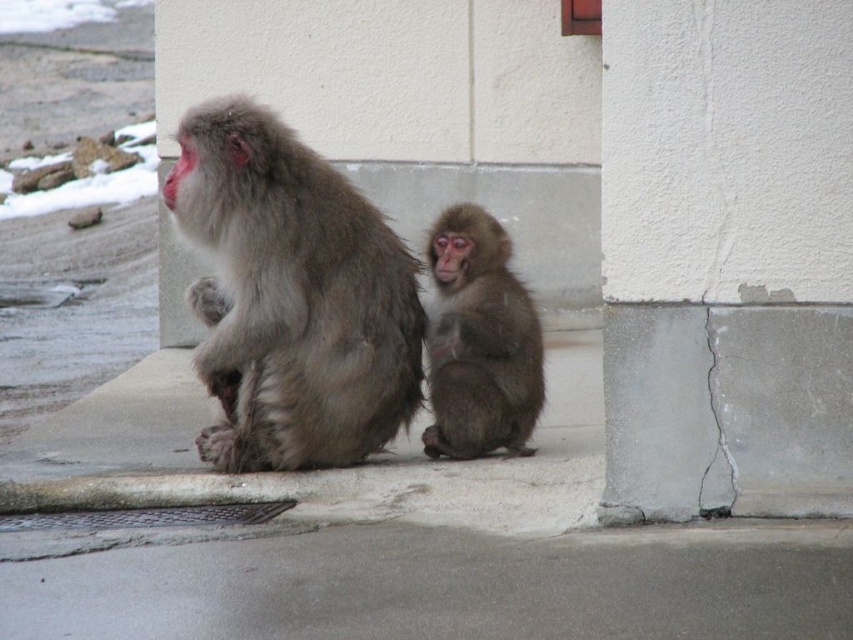
Question: Which object is farther from the camera taking this photo?

Choices:
 (A) fuzzy gray fur monkey at center
 (B) fuzzy brown monkey at center

Answer: (B)

Question: Can you confirm if white concrete pillar at lower right is thinner than fuzzy gray fur monkey at center?

Choices:
 (A) yes
 (B) no

Answer: (A)

Question: Can you confirm if white concrete pillar at lower right is smaller than fuzzy gray fur monkey at center?

Choices:
 (A) yes
 (B) no

Answer: (A)

Question: Is fuzzy gray fur monkey at center above fuzzy brown monkey at center?

Choices:
 (A) no
 (B) yes

Answer: (B)

Question: Which object is positioned closest to the fuzzy gray fur monkey at center?

Choices:
 (A) fuzzy brown monkey at center
 (B) white concrete pillar at lower right

Answer: (A)

Question: Which object appears farthest from the camera in this image?

Choices:
 (A) white concrete pillar at lower right
 (B) fuzzy brown monkey at center

Answer: (B)